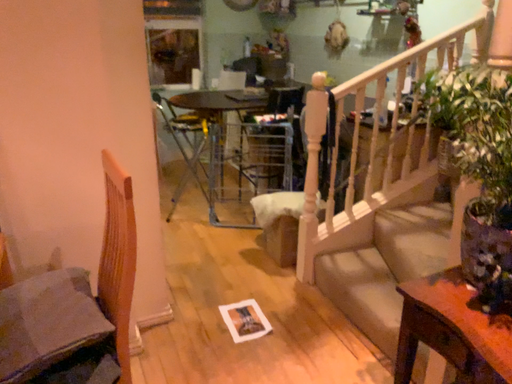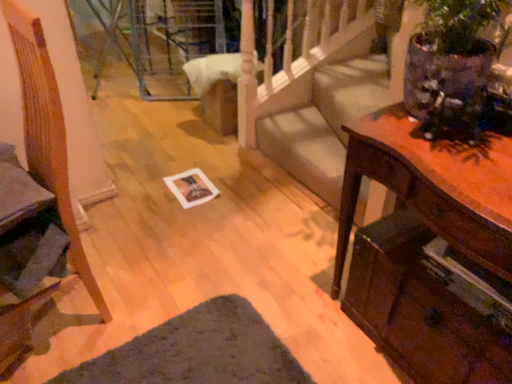
Question: How did the camera likely rotate when shooting the video?

Choices:
 (A) rotated upward
 (B) rotated downward

Answer: (B)